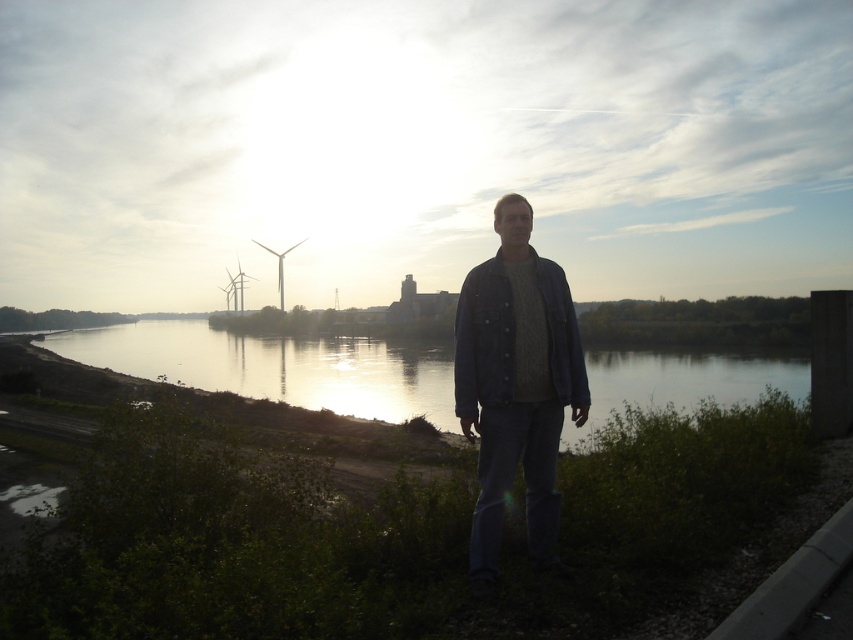
You are standing at the riverside and want to take a photo of the silvery reflective water at center. According to the coordinates provided, where exactly should you aim your camera to capture it?

You should aim your camera at point 0.573 on the horizontal axis and 0.327 on the vertical axis to capture the silvery reflective water at center.